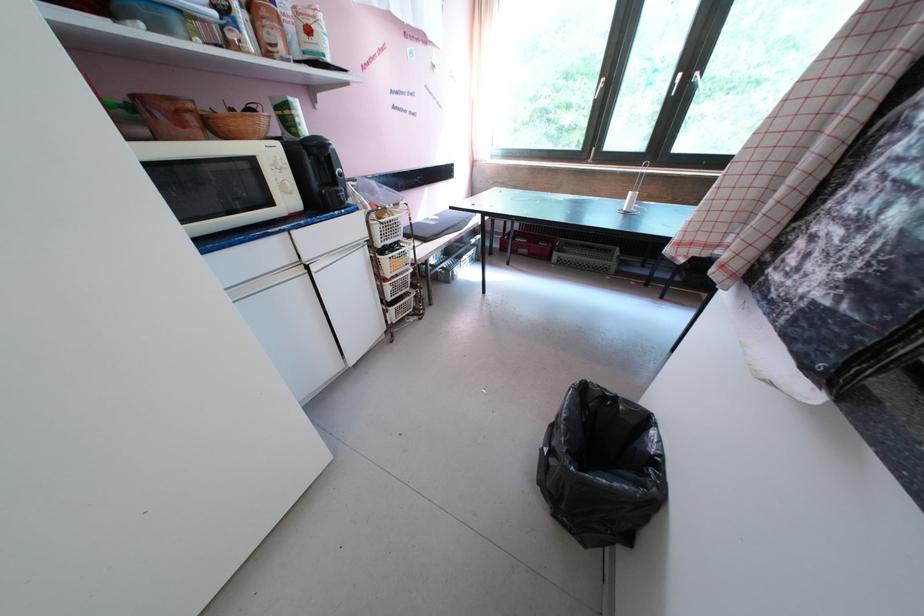
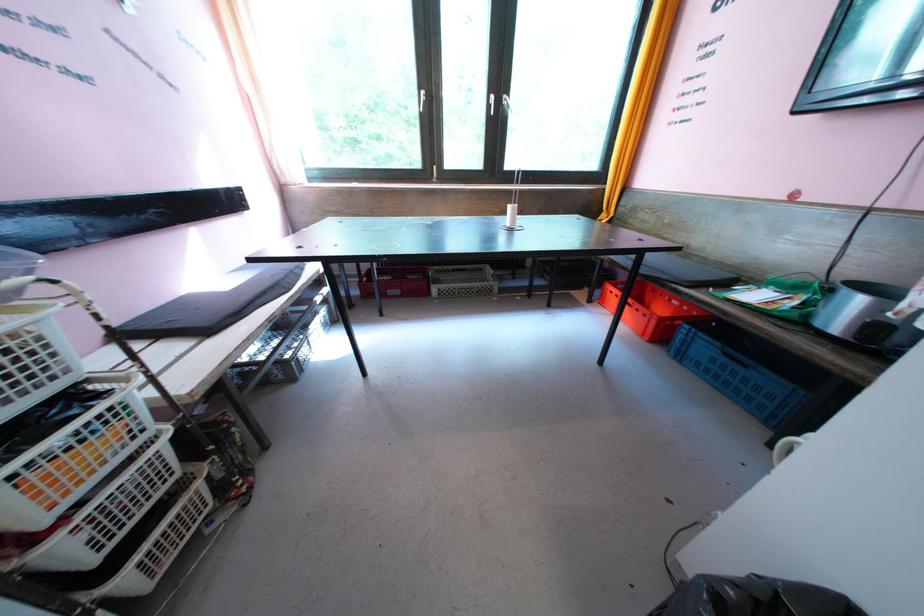
Question: The first image is from the beginning of the video and the second image is from the end. How did the camera likely rotate when shooting the video?

Choices:
 (A) Left
 (B) Right
 (C) Up
 (D) Down

Answer: (B)